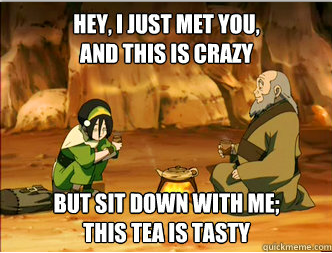
Identify the location of tea kettle. (183, 172).